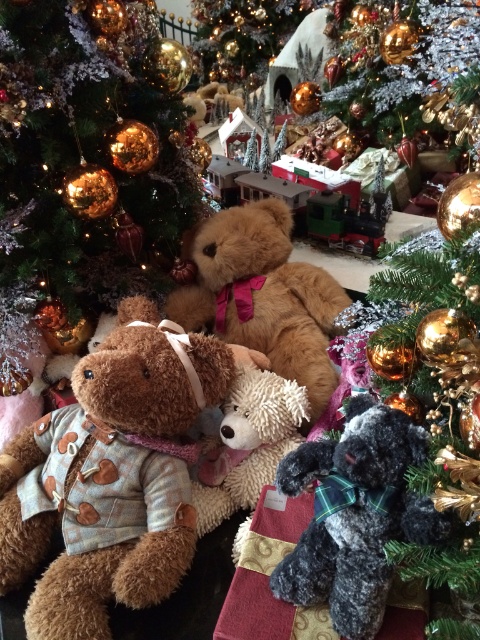
From the picture: You are a child who wants to reach the gold metallic ornaments at upper left and the soft brown teddy bear at center. Which one is easier to reach?

The soft brown teddy bear at center is easier to reach because it is shorter than the gold metallic ornaments at upper left.

You are a child looking at the Christmas tree and the presents. You want to reach the gold metallic ornaments at upper left and the dark gray plush bear at lower right. Which one is higher up?

The gold metallic ornaments at upper left are higher up than the dark gray plush bear at lower right.